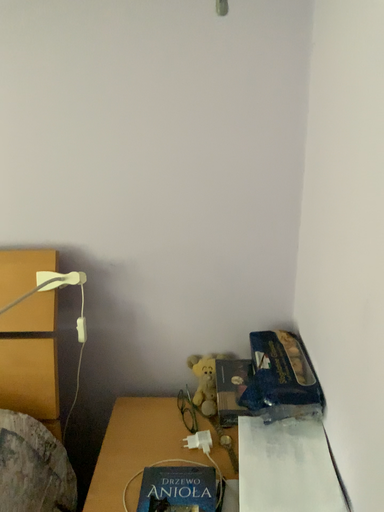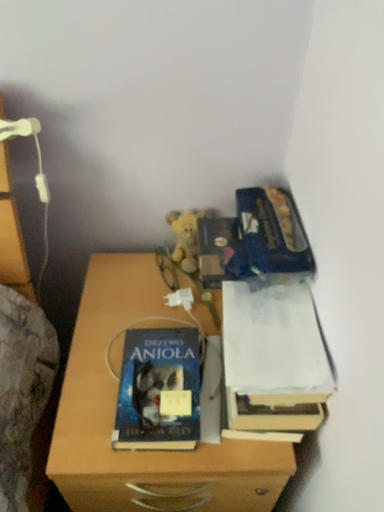
Question: How did the camera likely rotate when shooting the video?

Choices:
 (A) rotated downward
 (B) rotated upward

Answer: (A)